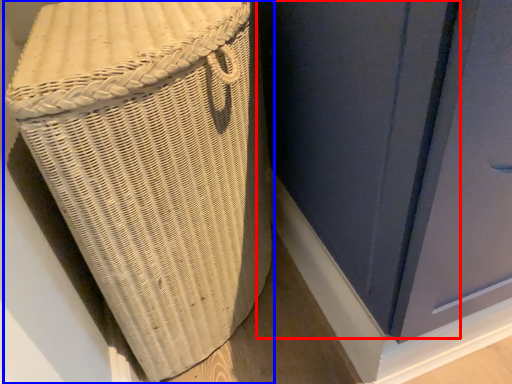
Question: Which point is closer to the camera, screen door (highlighted by a red box) or furniture (highlighted by a blue box)?

Choices:
 (A) screen door
 (B) furniture

Answer: (A)